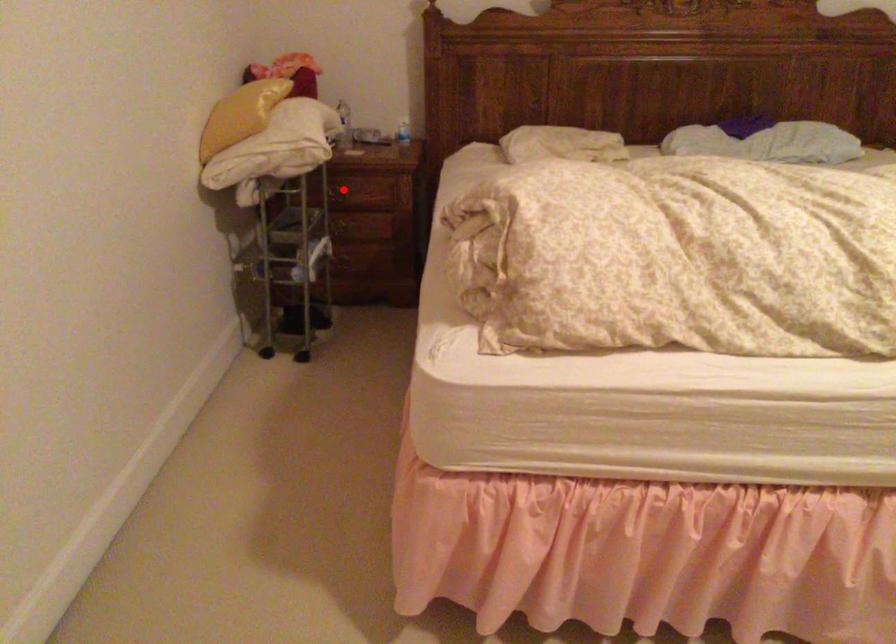
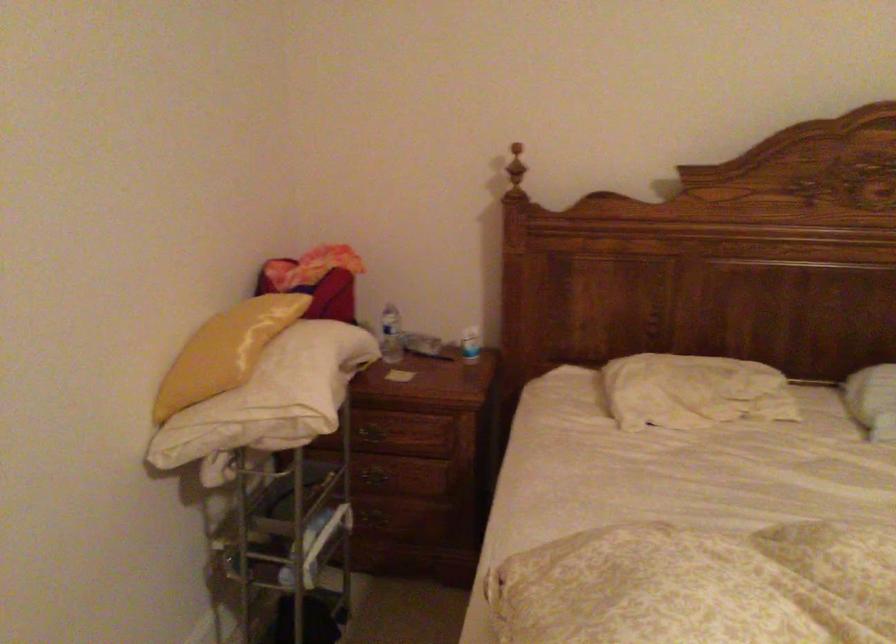
Question: I am providing you with two images of the same scene from different viewpoints. Image1 has a red point marked. In image2, the corresponding 3D location appears at what relative position? Reply with the corresponding letter.

Choices:
 (A) Closer
 (B) Farther

Answer: (A)